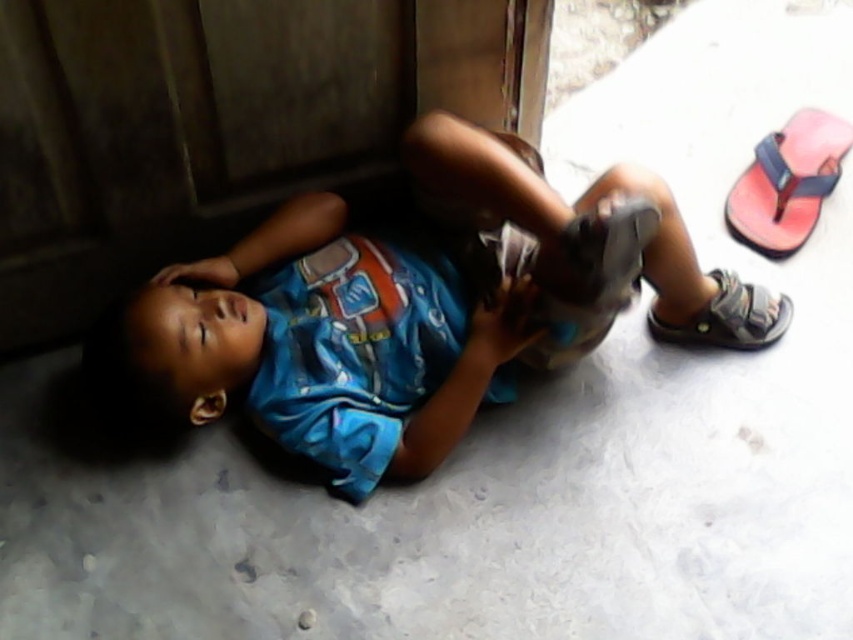
You are a parent trying to put shoes on your child. You have two options near the child, the pink rubber sandal at upper right and the gray fabric sandal at lower right. Which pair has a wider opening to slide the foot in?

The pink rubber sandal at upper right might be wider than gray fabric sandal at lower right, so the pink rubber sandal at upper right likely has a wider opening for easier sliding.

You are a parent looking for your child. You see the blue printed shirt at lower center and the pink rubber sandal at upper right. Which object is closer to the left side of the image?

The blue printed shirt at lower center is to the left of the pink rubber sandal at upper right, so it is closer to the left side of the image.

You are a parent trying to find your child a pair of sandals to put on. You see the pink rubber sandal at upper right and the gray fabric sandal at lower right. Which pair should you choose if you want the ones closer to the child?

You should choose the gray fabric sandal at lower right because it is closer to the child than the pink rubber sandal at upper right.